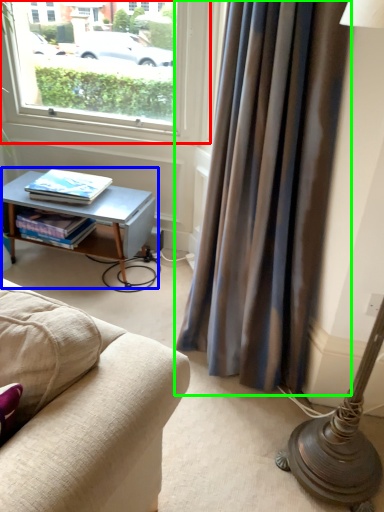
Question: Which object is positioned farthest from window (highlighted by a red box)? Select from table (highlighted by a blue box) and curtain (highlighted by a green box).

Choices:
 (A) table
 (B) curtain

Answer: (B)